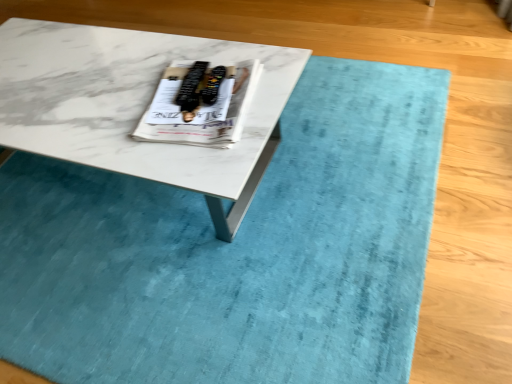
Where is `white glossy magazine at center`? The width and height of the screenshot is (512, 384). white glossy magazine at center is located at coordinates coord(200,104).

This screenshot has width=512, height=384. What do you see at coordinates (200, 104) in the screenshot?
I see `white glossy magazine at center` at bounding box center [200, 104].

You are a GUI agent. You are given a task and a screenshot of the screen. Output one action in this format:
    pyautogui.click(x=<x>, y=<y>)
    Task: Click on the white marble coffee table at center
    The height and width of the screenshot is (384, 512).
    Given the screenshot: What is the action you would take?
    pyautogui.click(x=134, y=106)

Describe the element at coordinates (134, 106) in the screenshot. I see `white marble coffee table at center` at that location.

Find the location of a particular element. The height and width of the screenshot is (384, 512). white glossy magazine at center is located at coordinates (200, 104).

Is white marble coffee table at center at the right side of white glossy magazine at center?

No, white marble coffee table at center is not to the right of white glossy magazine at center.

Which is behind, white marble coffee table at center or white glossy magazine at center?

white glossy magazine at center.

Which is in front, point (101, 55) or point (177, 72)?

Positioned in front is point (177, 72).

From the image's perspective, is white marble coffee table at center above white glossy magazine at center?

No, from the image's perspective, white marble coffee table at center is not on top of white glossy magazine at center.

From a real-world perspective, which is physically above, white marble coffee table at center or white glossy magazine at center?

From a 3D spatial view, white glossy magazine at center is above.

Which of these two, white marble coffee table at center or white glossy magazine at center, is thinner?

white glossy magazine at center is thinner.

Is white marble coffee table at center taller or shorter than white glossy magazine at center?

In the image, white marble coffee table at center appears to be taller than white glossy magazine at center.

Is white marble coffee table at center smaller than white glossy magazine at center?

Actually, white marble coffee table at center might be larger than white glossy magazine at center.

Is white marble coffee table at center positioned beyond the bounds of white glossy magazine at center?

Indeed, white marble coffee table at center is completely outside white glossy magazine at center.

Are white marble coffee table at center and white glossy magazine at center beside each other?

No, white marble coffee table at center is not beside white glossy magazine at center.

Is white marble coffee table at center looking in the opposite direction of white glossy magazine at center?

That's not correct — white marble coffee table at center is not looking away from white glossy magazine at center.

How distant is white marble coffee table at center from white glossy magazine at center?

They are 7.30 inches apart.

The height and width of the screenshot is (384, 512). I want to click on coffee table on the left of white glossy magazine at center, so click(134, 106).

Is white glossy magazine at center at the left side of white marble coffee table at center?

No.

Is white glossy magazine at center behind white marble coffee table at center?

Yes, it is behind white marble coffee table at center.

Which is behind, point (178, 133) or point (76, 72)?

The point (76, 72) is farther from the camera.

From the image's perspective, which object appears higher, white glossy magazine at center or white marble coffee table at center?

From the image's view, white glossy magazine at center is above.

From a real-world perspective, is white glossy magazine at center under white marble coffee table at center?

Actually, white glossy magazine at center is physically above white marble coffee table at center in the real world.

Which of these two, white glossy magazine at center or white marble coffee table at center, is wider?

white marble coffee table at center.

Considering the sizes of white glossy magazine at center and white marble coffee table at center in the image, is white glossy magazine at center taller or shorter than white marble coffee table at center?

Considering their sizes, white glossy magazine at center has less height than white marble coffee table at center.

Considering the sizes of objects white glossy magazine at center and white marble coffee table at center in the image provided, who is bigger, white glossy magazine at center or white marble coffee table at center?

With larger size is white marble coffee table at center.

Is white glossy magazine at center not within white marble coffee table at center?

No.

Consider the image. Is white glossy magazine at center placed right next to white marble coffee table at center?

white glossy magazine at center and white marble coffee table at center are not in contact.

Is white glossy magazine at center looking in the opposite direction of white marble coffee table at center?

No, white glossy magazine at center's orientation is not away from white marble coffee table at center.

How far apart are white glossy magazine at center and white marble coffee table at center?

white glossy magazine at center and white marble coffee table at center are 7.30 inches apart.

This screenshot has height=384, width=512. What are the coordinates of `magazine behind the white marble coffee table at center` in the screenshot? It's located at (200, 104).

I want to click on coffee table in front of the white glossy magazine at center, so click(134, 106).

Identify the location of coffee table to the left of white glossy magazine at center. (134, 106).